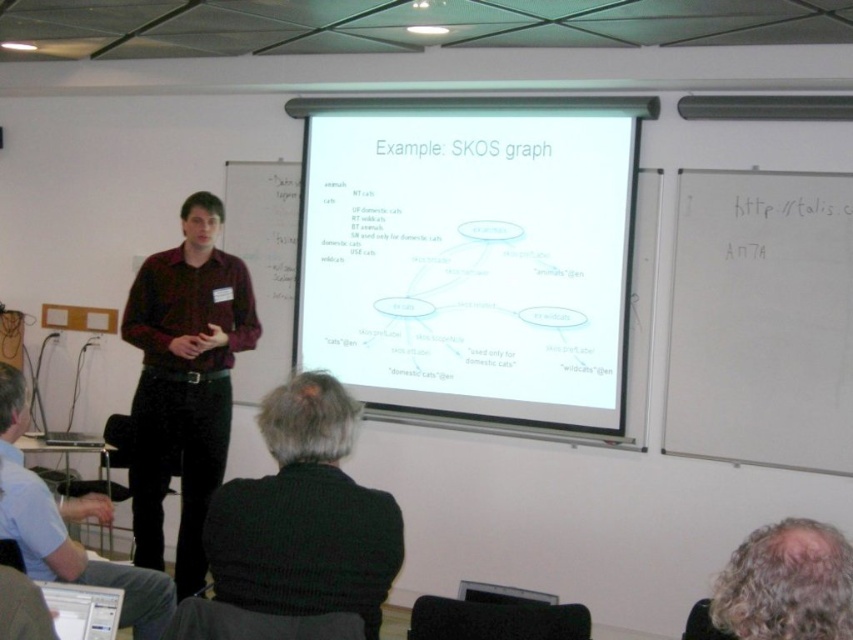
Can you confirm if matte red shirt at center is taller than dark brown leather jacket at lower left?

Yes, matte red shirt at center is taller than dark brown leather jacket at lower left.

Is matte red shirt at center positioned in front of dark brown leather jacket at lower left?

No, it is not.

Is point (196, 248) closer to viewer compared to point (39, 556)?

No, (196, 248) is behind (39, 556).

What are the coordinates of `matte red shirt at center` in the screenshot? It's located at (184, 381).

Who is more forward, (440,380) or (195,349)?

Point (195,349)

Measure the distance between point [345,256] and camera.

They are 4.22 meters apart.

Image resolution: width=853 pixels, height=640 pixels. Identify the location of white paper at center. (469, 260).

Which is more to the right, white paper at center or dark brown leather jacket at lower left?

white paper at center

Which is behind, point (361, 328) or point (78, 515)?

The point (361, 328) is behind.

Between point (328, 272) and point (4, 476), which one is positioned in front?

Point (4, 476) is in front.

Identify the location of white paper at center. (469, 260).